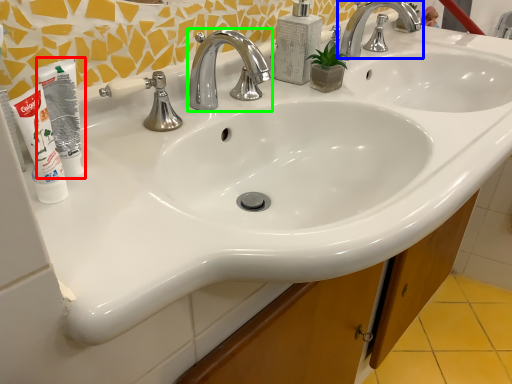
Question: Which object is the farthest from mouthwash (highlighted by a red box)? Choose among these: tap (highlighted by a blue box) or tap (highlighted by a green box).

Choices:
 (A) tap
 (B) tap

Answer: (A)